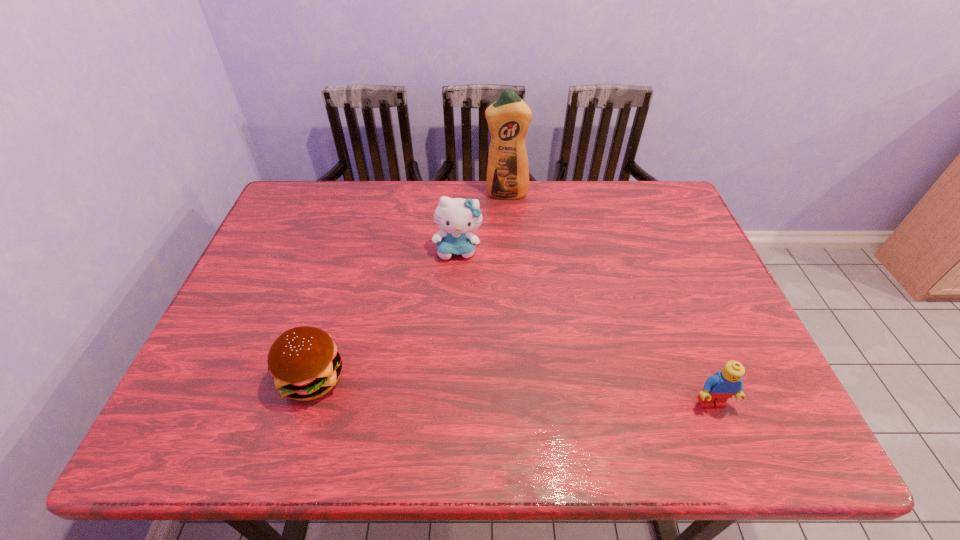
Find the location of a particular element. Image resolution: width=960 pixels, height=540 pixels. the leftmost object is located at coordinates (304, 362).

Find the location of a particular element. This screenshot has width=960, height=540. Lego is located at coordinates (724, 384).

This screenshot has height=540, width=960. In order to click on the third object from right to left in this screenshot , I will do `click(456, 216)`.

Where is `the third shortest object`? The height and width of the screenshot is (540, 960). the third shortest object is located at coordinates (456, 216).

This screenshot has width=960, height=540. I want to click on the tallest object, so click(x=508, y=118).

Identify the location of detergent. (508, 118).

Locate an element on the screen. This screenshot has width=960, height=540. vacant space located 0.250m on the back of the hamburger is located at coordinates (343, 274).

Where is `vacant area situated on the face of the kitten`? This screenshot has height=540, width=960. vacant area situated on the face of the kitten is located at coordinates (458, 290).

The image size is (960, 540). I want to click on vacant space located 0.230m on the face of the kitten, so click(458, 329).

The width and height of the screenshot is (960, 540). Find the location of `blank space located on the face of the kitten`. blank space located on the face of the kitten is located at coordinates (458, 380).